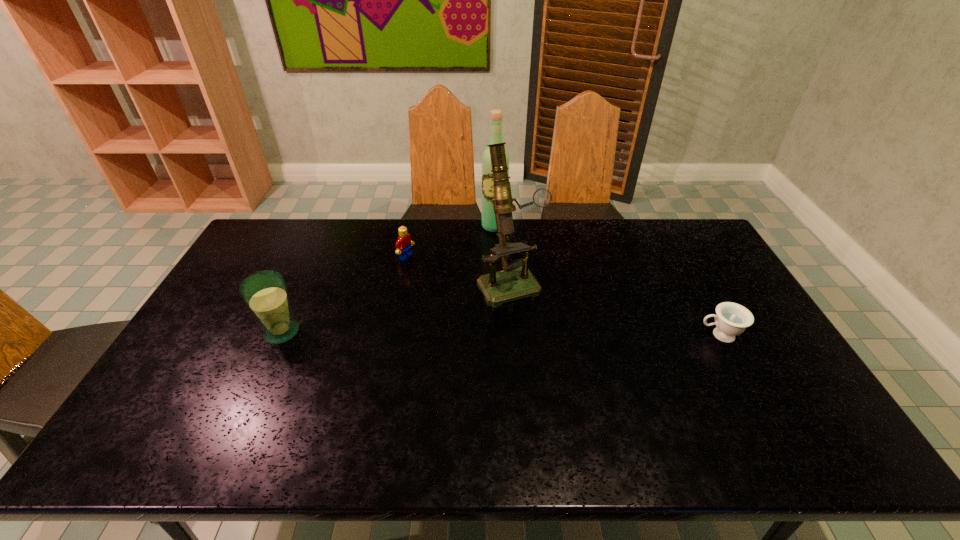
Identify the location of free space located 0.250m on the side of the shortest object with the handle. (610, 335).

Find the location of a particular element. free location located 0.390m on the side of the shortest object with the handle is located at coordinates (562, 335).

The image size is (960, 540). Find the location of `free space located on the front-facing side of the Lego`. free space located on the front-facing side of the Lego is located at coordinates (434, 272).

This screenshot has width=960, height=540. Identify the location of vacant space located 0.120m on the front-facing side of the Lego. (438, 274).

Locate an element on the screen. Image resolution: width=960 pixels, height=540 pixels. free region located 0.220m on the front-facing side of the Lego is located at coordinates (461, 287).

This screenshot has width=960, height=540. In order to click on free space located on the front-facing side of the farthest object in this screenshot , I will do `click(506, 305)`.

What are the coordinates of `free space located 0.200m on the front-facing side of the farthest object` in the screenshot? It's located at (500, 267).

Identify the location of free space located on the front-facing side of the farthest object. The height and width of the screenshot is (540, 960). (499, 258).

The width and height of the screenshot is (960, 540). Identify the location of vacant space located at the eyepiece of the microscope. (556, 356).

At what (x,y) coordinates should I click in order to perform the action: click on vacant space located 0.180m at the eyepiece of the microscope. Please return your answer as a coordinate pair (x, y). The height and width of the screenshot is (540, 960). Looking at the image, I should click on (551, 348).